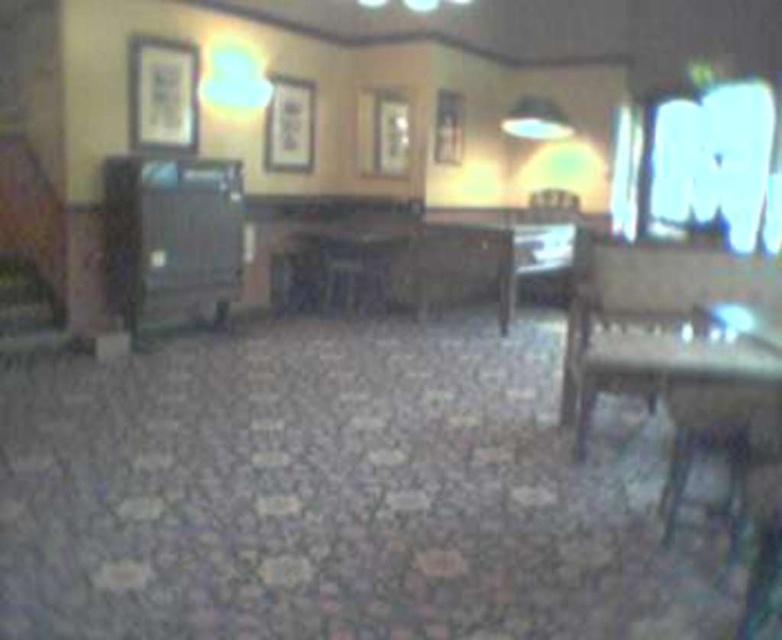
Is point (752, 340) in front of point (551, 116)?

Yes, it is in front of point (551, 116).

Between wooden table at lower right and matte white lampshade at upper center, which one has less height?

Standing shorter between the two is matte white lampshade at upper center.

Based on the photo, who is more forward, (x=725, y=509) or (x=551, y=106)?

Point (x=725, y=509) is in front.

You are a GUI agent. You are given a task and a screenshot of the screen. Output one action in this format:
    pyautogui.click(x=<x>, y=<y>)
    Task: Click on the wooden table at lower right
    This screenshot has width=782, height=640.
    Given the screenshot: What is the action you would take?
    pyautogui.click(x=691, y=388)